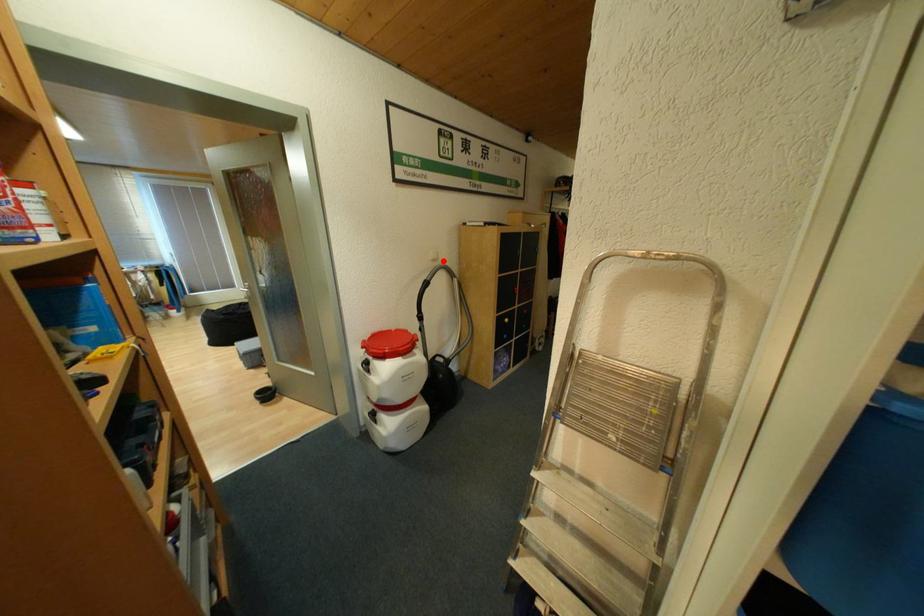
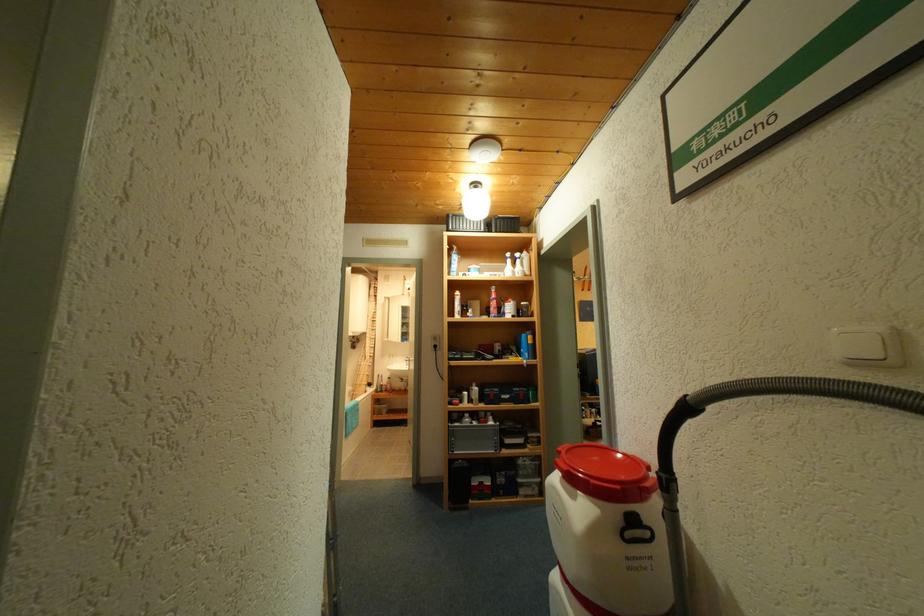
Where in the second image is the point corresponding to the highlighted location from the first image?

(868, 363)